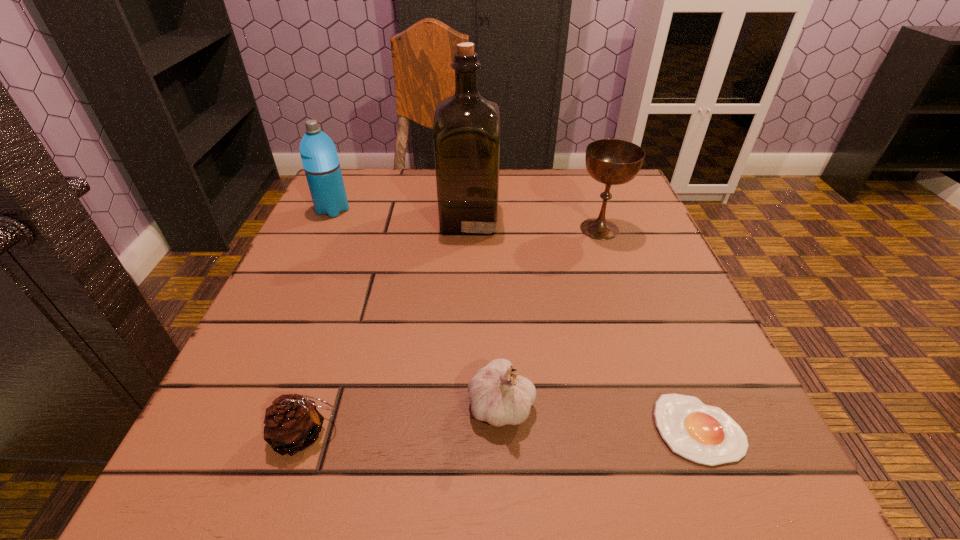
Image resolution: width=960 pixels, height=540 pixels. I want to click on blank space located on the right of the third shortest object, so click(x=712, y=405).

Locate an element on the screen. The image size is (960, 540). free region located 0.080m with a leaf charm attached to the second shortest object is located at coordinates (397, 435).

The width and height of the screenshot is (960, 540). Identify the location of blank space located on the left of the egg yolk. (604, 429).

In order to click on liquor present at the far edge in this screenshot , I will do `click(466, 132)`.

The width and height of the screenshot is (960, 540). I want to click on thermos bottle that is at the far edge, so click(319, 157).

This screenshot has width=960, height=540. In order to click on chalice that is at the far edge in this screenshot , I will do `click(609, 161)`.

Identify the location of garlic located in the near edge section of the desktop. (497, 396).

Find the location of a particular element. This screenshot has height=540, width=960. pinecone at the near edge is located at coordinates (292, 423).

Find the location of a particular element. This screenshot has height=540, width=960. egg yolk located at the near edge is located at coordinates (705, 434).

Image resolution: width=960 pixels, height=540 pixels. I want to click on thermos bottle that is at the left edge, so click(x=319, y=157).